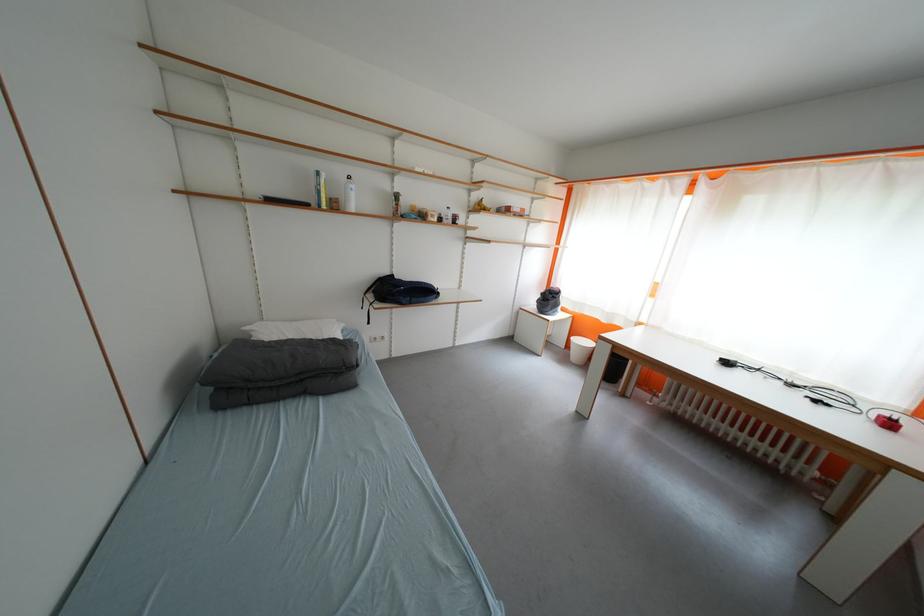
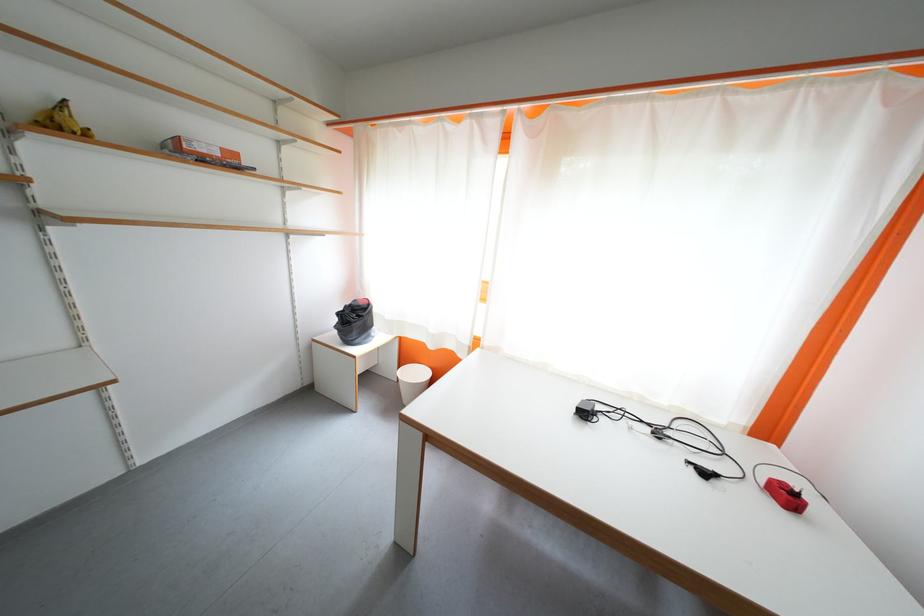
In the second image, find the point that corresponds to pixel 825 405 in the first image.

(713, 477)